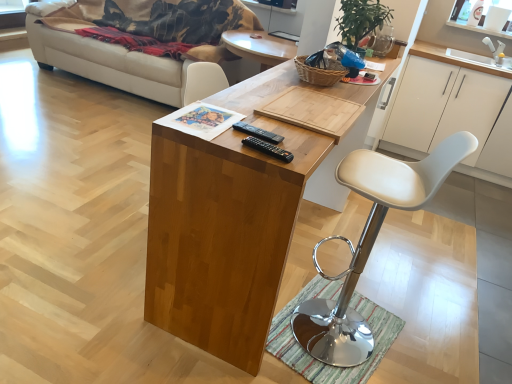
Find the location of `free space to the left of wooden desk at center`. free space to the left of wooden desk at center is located at coordinates (83, 236).